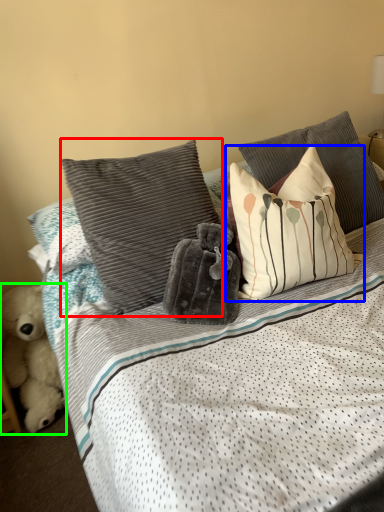
Question: Which is nearer to the pillow (highlighted by a red box)? pillow (highlighted by a blue box) or teddy bear (highlighted by a green box).

Choices:
 (A) pillow
 (B) teddy bear

Answer: (A)